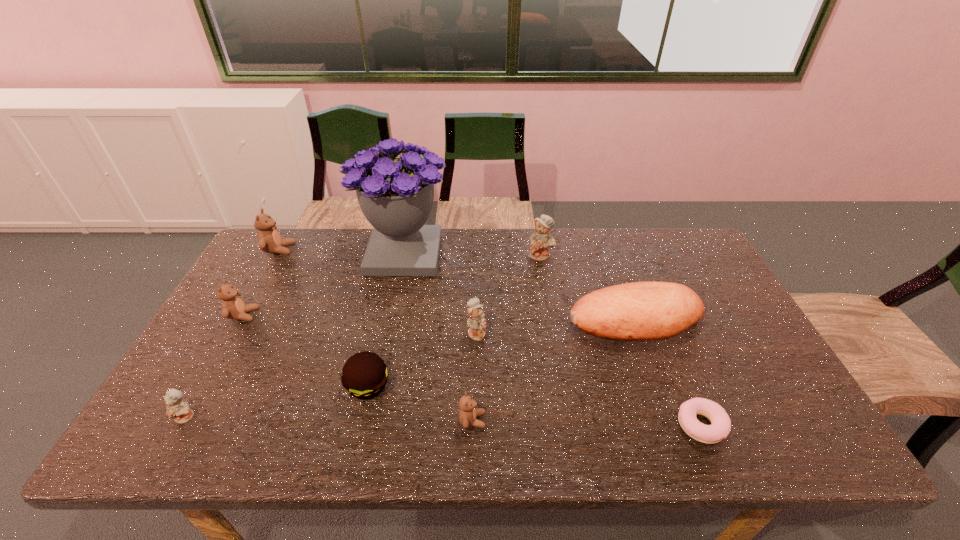
The width and height of the screenshot is (960, 540). I want to click on unoccupied position between the rightmost brown teddy bear and the purple doughnut, so click(587, 423).

Locate an element on the screen. The height and width of the screenshot is (540, 960). free space that is in between the second smallest brown teddy bear and the bouquet is located at coordinates (324, 285).

At what (x,y) coordinates should I click in order to perform the action: click on vacant space that's between the rightmost brown teddy bear and the second blue teddy bear from left to right. Please return your answer as a coordinate pair (x, y). This screenshot has height=540, width=960. Looking at the image, I should click on [474, 376].

Identify which object is the eighth closest to the farthest blue teddy bear. Please provide its 2D coordinates. Your answer should be formatted as a tuple, i.e. [(x, y)], where the tuple contains the x and y coordinates of a point satisfying the conditions above.

[(233, 307)]

At what (x,y) coordinates should I click in order to perform the action: click on the seventh closest object to the biggest blue teddy bear. Please return your answer as a coordinate pair (x, y). Looking at the image, I should click on (269, 240).

I want to click on the sixth closest teddy bear relative to the patty, so click(x=541, y=240).

Point out which teddy bear is positioned as the fourth nearest to the second blue teddy bear from right to left. Please provide its 2D coordinates. Your answer should be formatted as a tuple, i.e. [(x, y)], where the tuple contains the x and y coordinates of a point satisfying the conditions above.

[(176, 408)]

Locate an element on the screen. the second closest brown teddy bear to the second nearest brown teddy bear is located at coordinates (467, 415).

Where is `the closest brown teddy bear relative to the farthest brown teddy bear`? This screenshot has width=960, height=540. the closest brown teddy bear relative to the farthest brown teddy bear is located at coordinates (233, 307).

The image size is (960, 540). Identify the location of blue teddy bear that is the closest to the second blue teddy bear from right to left. (541, 240).